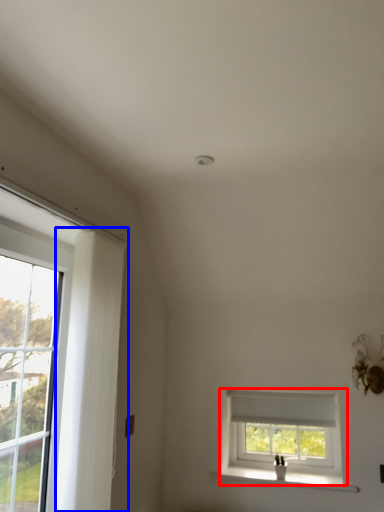
Question: Which object appears closest to the camera in this image, window (highlighted by a red box) or curtain (highlighted by a blue box)?

Choices:
 (A) window
 (B) curtain

Answer: (B)